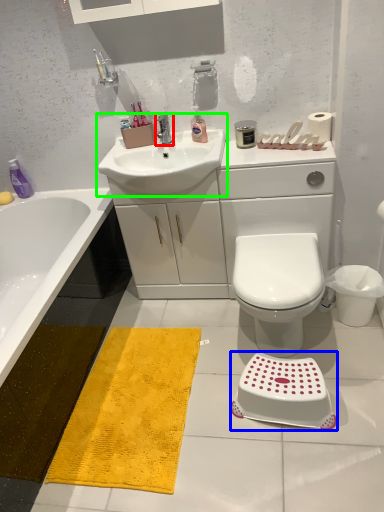
Question: Which object is positioned closest to tap (highlighted by a red box)? Select from step stool (highlighted by a blue box) and sink (highlighted by a green box).

Choices:
 (A) step stool
 (B) sink

Answer: (B)